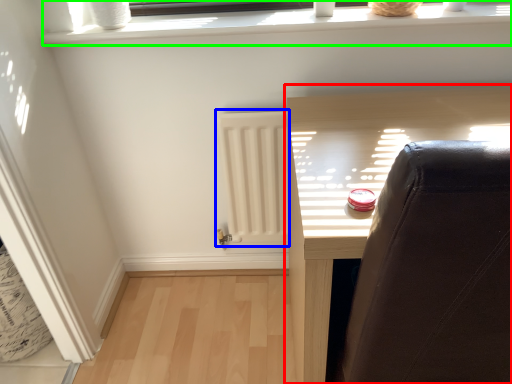
Question: Based on their relative distances, which object is nearer to furniture (highlighted by a red box)? Choose from radiator (highlighted by a blue box) and window frame (highlighted by a green box).

Choices:
 (A) radiator
 (B) window frame

Answer: (A)